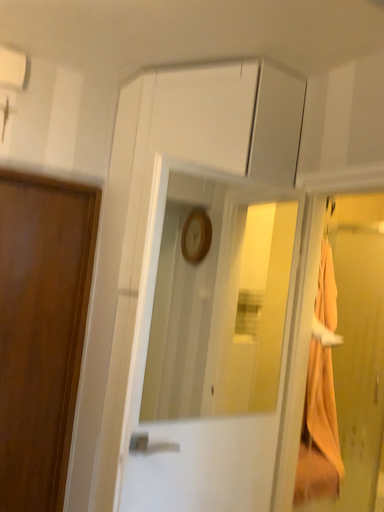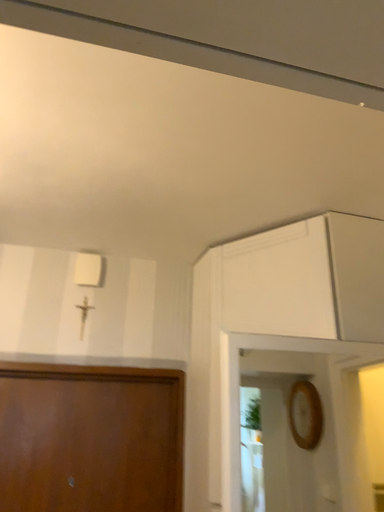
Question: Which way did the camera rotate in the video?

Choices:
 (A) rotated upward
 (B) rotated downward

Answer: (A)